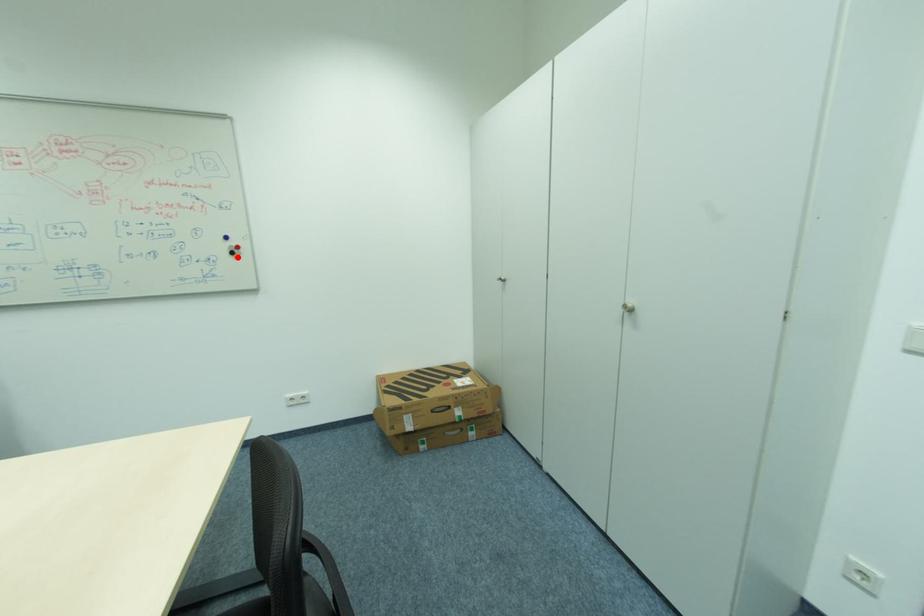
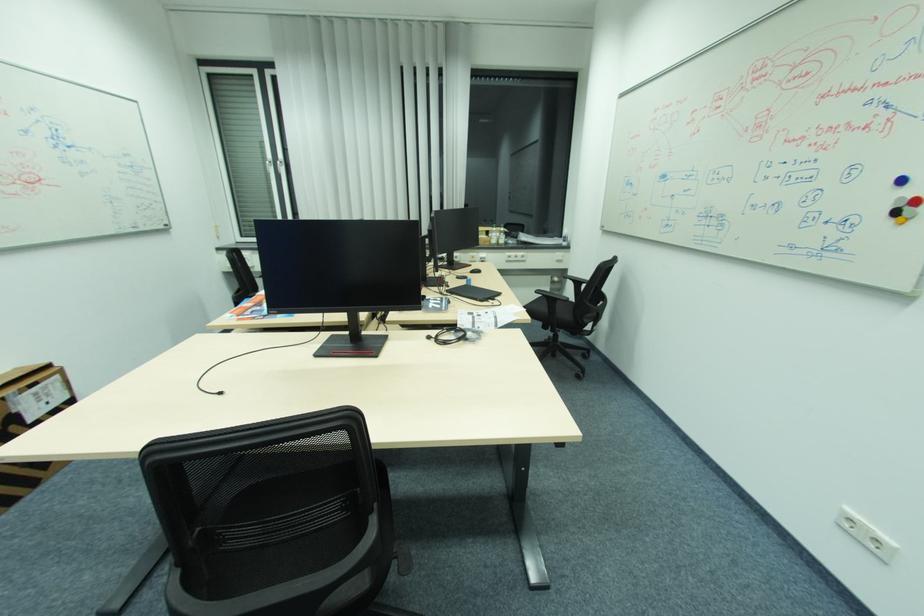
In the second image, find the point that corresponds to the highlighted location in the first image.

(896, 221)